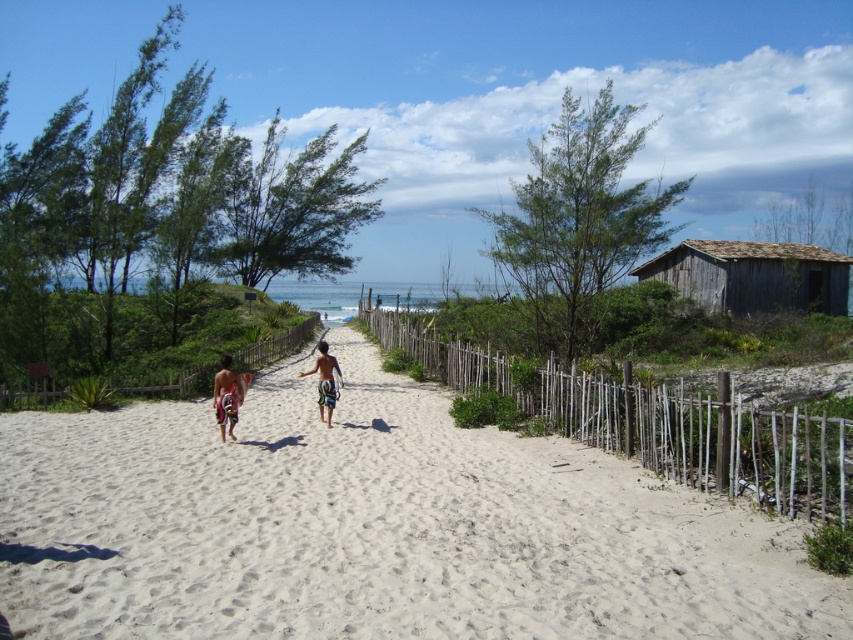
Question: Does white sandy beach at center have a lesser width compared to weathered wood hut at right?

Choices:
 (A) no
 (B) yes

Answer: (B)

Question: Does white sandy beach at center have a larger size compared to multicolored swim trunks at center?

Choices:
 (A) yes
 (B) no

Answer: (B)

Question: Which object appears farthest from the camera in this image?

Choices:
 (A) multicolored striped shorts at center
 (B) multicolored swim trunks at center

Answer: (A)

Question: Which point is closer to the camera?

Choices:
 (A) multicolored striped shorts at center
 (B) wooden at right
 (C) multicolored board shorts at center
 (D) weathered wood hut at right

Answer: (B)

Question: Which of the following is the closest to the observer?

Choices:
 (A) white sandy beach at center
 (B) weathered wood hut at right

Answer: (A)

Question: Observing the image, what is the correct spatial positioning of multicolored board shorts at center in reference to multicolored striped shorts at center?

Choices:
 (A) left
 (B) right

Answer: (B)